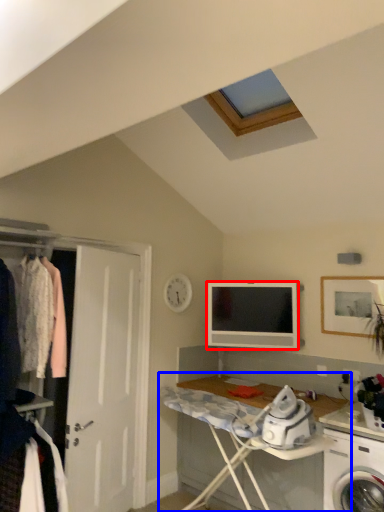
Question: Which of the following is the farthest to the observer, television (highlighted by a red box) or desk (highlighted by a blue box)?

Choices:
 (A) television
 (B) desk

Answer: (A)